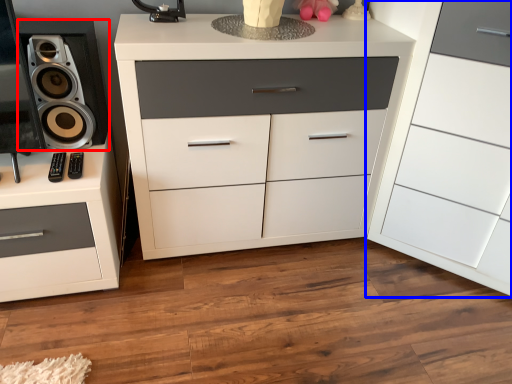
Question: Which point is closer to the camera, speaker (highlighted by a red box) or chest of drawers (highlighted by a blue box)?

Choices:
 (A) speaker
 (B) chest of drawers

Answer: (B)